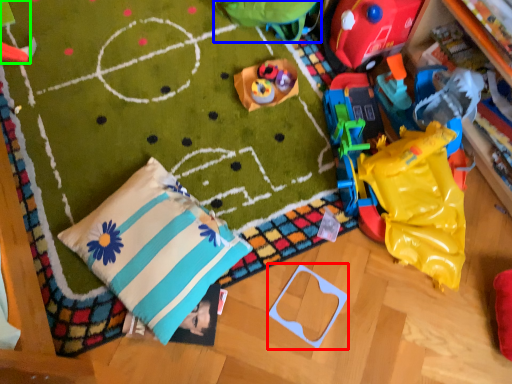
Question: Considering the real-world distances, which object is closest to toy (highlighted by a red box)? toy (highlighted by a blue box) or toy (highlighted by a green box).

Choices:
 (A) toy
 (B) toy

Answer: (A)